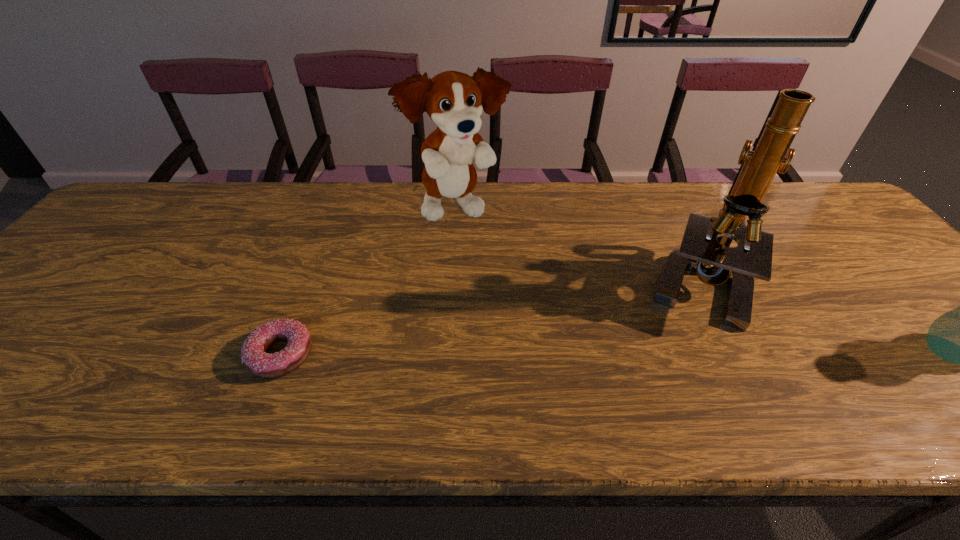
You are a GUI agent. You are given a task and a screenshot of the screen. Output one action in this format:
    pyautogui.click(x=<x>, y=<y>)
    Task: Click on the vacant space located 0.380m on the face of the third shortest object
    
    Given the screenshot: What is the action you would take?
    pyautogui.click(x=571, y=322)

This screenshot has width=960, height=540. Find the location of `free region located on the face of the third shortest object`. free region located on the face of the third shortest object is located at coordinates (498, 249).

The image size is (960, 540). In order to click on object at the far edge in this screenshot , I will do `click(454, 101)`.

Identify the location of object situated at the near edge. (253, 352).

At what (x,y) coordinates should I click in order to perform the action: click on vacant space at the far edge. Please return your answer as a coordinate pair (x, y). This screenshot has height=540, width=960. Looking at the image, I should click on tap(492, 190).

In the image, there is a desktop. What are the coordinates of `vacant region at the left edge` in the screenshot? It's located at [x=79, y=308].

At what (x,y) coordinates should I click in order to perform the action: click on blank space at the right edge of the desktop. Please return your answer as a coordinate pair (x, y). The width and height of the screenshot is (960, 540). Looking at the image, I should click on (905, 325).

You are a GUI agent. You are given a task and a screenshot of the screen. Output one action in this format:
    pyautogui.click(x=<x>, y=<y>)
    Task: Click on the free location at the far left corner of the desktop
    
    Given the screenshot: What is the action you would take?
    pyautogui.click(x=150, y=183)

Where is `free point between the second object from right to left and the third shortest object`? free point between the second object from right to left and the third shortest object is located at coordinates (577, 246).

Locate an element on the screen. The width and height of the screenshot is (960, 540). empty space between the microscope and the second object from left to right is located at coordinates (577, 246).